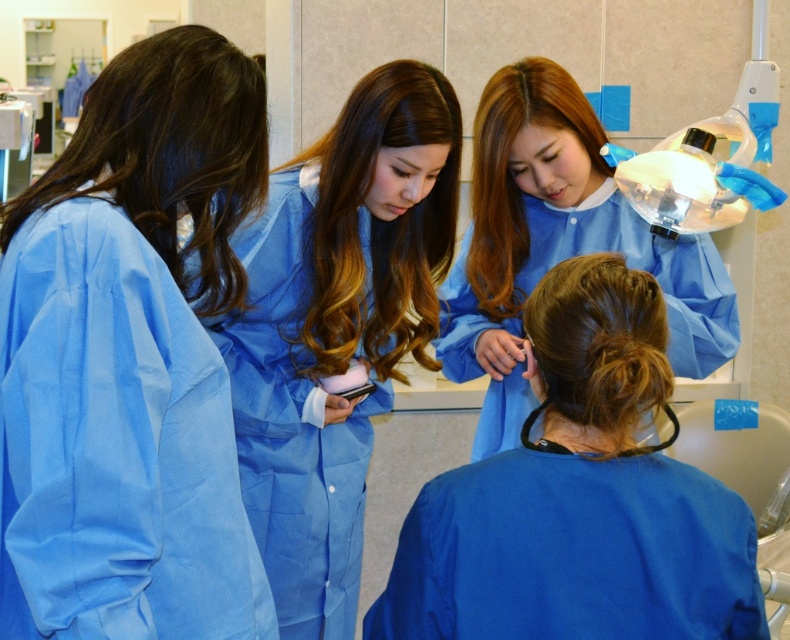
From the picture: Who is positioned more to the right, blue smooth scrubs at lower center or blue smooth uniform at upper center?

From the viewer's perspective, blue smooth uniform at upper center appears more on the right side.

Describe the element at coordinates (578, 499) in the screenshot. I see `blue smooth scrubs at lower center` at that location.

Is point (700, 608) positioned after point (608, 244)?

No.

The width and height of the screenshot is (790, 640). I want to click on blue smooth scrubs at lower center, so click(578, 499).

Is blue smooth scrubs at left below shiny brown hair at upper center?

Correct, blue smooth scrubs at left is located below shiny brown hair at upper center.

Which is more to the right, blue smooth scrubs at left or shiny brown hair at upper center?

shiny brown hair at upper center is more to the right.

Who is more forward, [70,484] or [540,83]?

Point [70,484] is in front.

Identify the location of blue smooth scrubs at left. (130, 358).

Who is higher up, blue smooth scrubs at left or brown shiny hair at center?

Positioned higher is brown shiny hair at center.

Is the position of blue smooth scrubs at left more distant than that of brown shiny hair at center?

No, blue smooth scrubs at left is in front of brown shiny hair at center.

Locate an element on the screen. The image size is (790, 640). blue smooth scrubs at left is located at coordinates (130, 358).